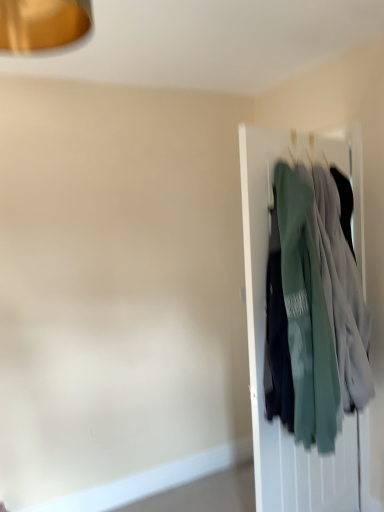
What do you see at coordinates (264, 330) in the screenshot?
I see `matte white door at right` at bounding box center [264, 330].

Where is `matte white door at right`? This screenshot has height=512, width=384. matte white door at right is located at coordinates (264, 330).

Find the location of `matte white door at right`. matte white door at right is located at coordinates (264, 330).